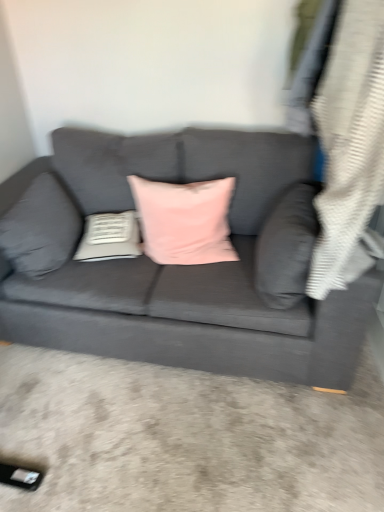
Question: Can you confirm if matte gray couch at center is taller than white textured pillow at center, the 2th pillow viewed from the left?

Choices:
 (A) no
 (B) yes

Answer: (B)

Question: From the image's perspective, is matte gray couch at center beneath white textured pillow at center, the 2th pillow viewed from the left?

Choices:
 (A) yes
 (B) no

Answer: (B)

Question: Is the depth of matte gray couch at center less than that of white textured pillow at center, the 3th pillow viewed from the right?

Choices:
 (A) no
 (B) yes

Answer: (B)

Question: Considering the relative positions of matte gray couch at center and white textured pillow at center, the 3th pillow viewed from the right, in the image provided, is matte gray couch at center to the right of white textured pillow at center, the 3th pillow viewed from the right, from the viewer's perspective?

Choices:
 (A) no
 (B) yes

Answer: (B)

Question: From a real-world perspective, is matte gray couch at center on top of white textured pillow at center, the 3th pillow viewed from the right?

Choices:
 (A) no
 (B) yes

Answer: (A)

Question: Is white textured pillow at center, the 3th pillow viewed from the right, spatially inside matte gray pillow at right, which is counted as the 1th pillow, starting from the right, or outside of it?

Choices:
 (A) outside
 (B) inside

Answer: (A)

Question: Is white textured pillow at center, the 3th pillow viewed from the right, taller or shorter than matte gray pillow at right, which is counted as the 1th pillow, starting from the right?

Choices:
 (A) short
 (B) tall

Answer: (A)

Question: Relative to matte gray pillow at right, the fourth pillow when ordered from left to right, is white textured pillow at center, the 2th pillow viewed from the left, in front or behind?

Choices:
 (A) front
 (B) behind

Answer: (B)

Question: Considering the positions of point tap(97, 258) and point tap(304, 248), is point tap(97, 258) closer or farther from the camera than point tap(304, 248)?

Choices:
 (A) farther
 (B) closer

Answer: (A)

Question: In terms of width, does matte gray couch at center look wider or thinner when compared to white textured pillow at center, the 3th pillow viewed from the right?

Choices:
 (A) wide
 (B) thin

Answer: (A)

Question: Relative to white textured pillow at center, the 3th pillow viewed from the right, is matte gray couch at center in front or behind?

Choices:
 (A) front
 (B) behind

Answer: (A)

Question: From a real-world perspective, is matte gray couch at center above or below white textured pillow at center, the 2th pillow viewed from the left?

Choices:
 (A) above
 (B) below

Answer: (B)

Question: Which is correct: matte gray couch at center is inside white textured pillow at center, the 3th pillow viewed from the right, or outside of it?

Choices:
 (A) inside
 (B) outside

Answer: (B)

Question: Do you think matte gray pillow at left, marked as the 1th pillow in a left-to-right arrangement, is within pink velvet pillow at center, the 3th pillow in the left-to-right sequence, or outside of it?

Choices:
 (A) outside
 (B) inside

Answer: (A)

Question: Would you say matte gray pillow at left, marked as the 1th pillow in a left-to-right arrangement, is to the left or to the right of pink velvet pillow at center, the 3th pillow in the left-to-right sequence, in the picture?

Choices:
 (A) right
 (B) left

Answer: (B)